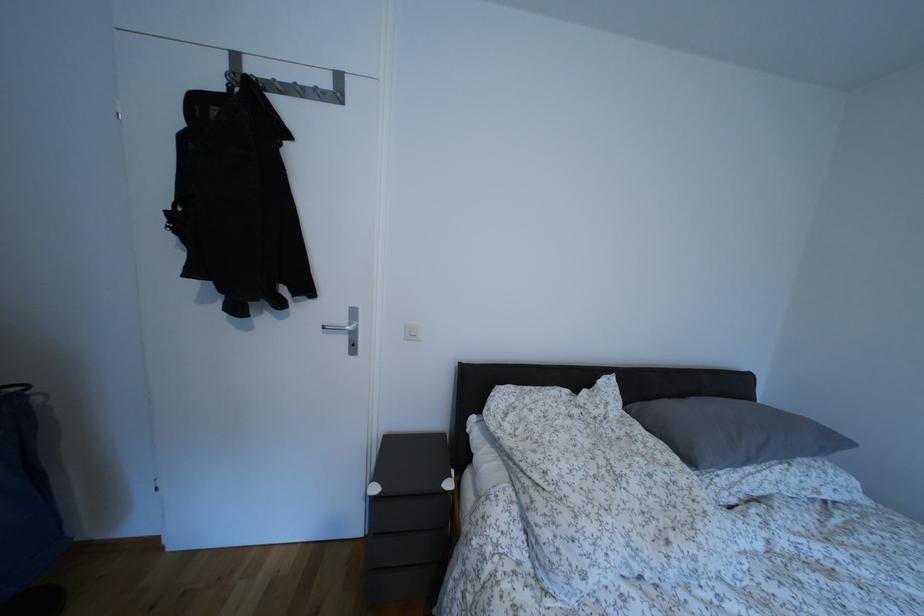
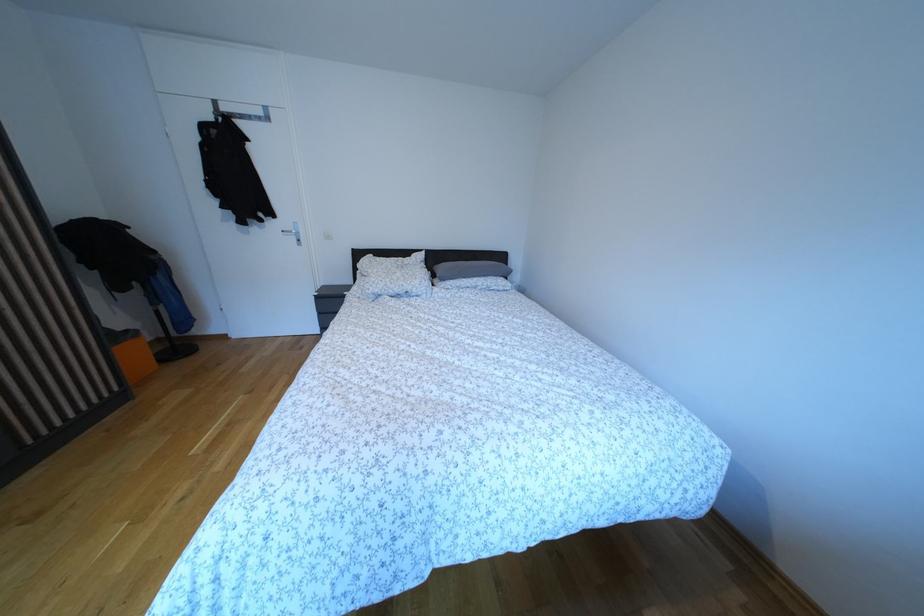
The point at (641, 493) is marked in the first image. Where is the corresponding point in the second image?

(406, 281)